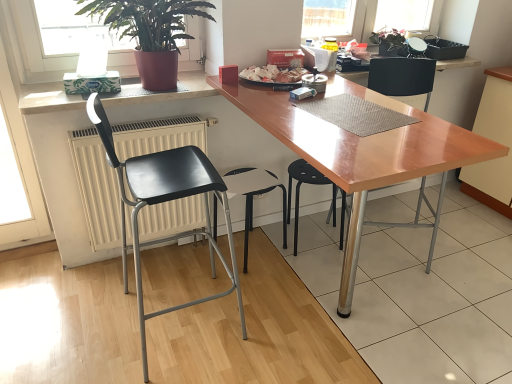
Locate an element on the screen. vacant area that is situated to the right of matte black chair at center, arranged as the fourth chair when viewed from the left is located at coordinates (462, 253).